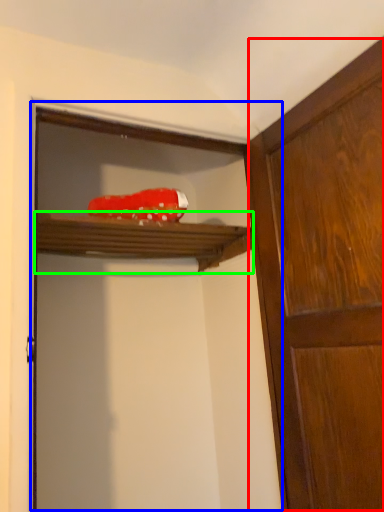
Question: Which is nearer to the cabinetry (highlighted by a red box)? screen door (highlighted by a blue box) or shelf (highlighted by a green box).

Choices:
 (A) screen door
 (B) shelf

Answer: (A)